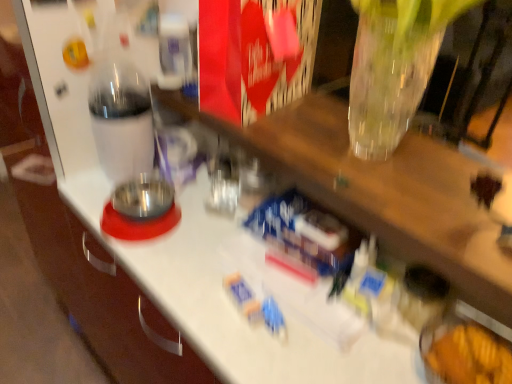
Question: From a real-world perspective, relative to transparent plastic bottle at left, is blue plastic toy at center, the second toy when ordered from top to bottom, vertically above or below?

Choices:
 (A) below
 (B) above

Answer: (A)

Question: Would you say blue plastic toy at center, the second toy when ordered from top to bottom, is to the left or to the right of transparent plastic bottle at left in the picture?

Choices:
 (A) left
 (B) right

Answer: (B)

Question: Which is farther from the transparent plastic bottle at left?

Choices:
 (A) blue plastic toy at center, the 1th toy when ordered from bottom to top
 (B) blue plastic toy at center, placed as the first toy when sorted from top to bottom

Answer: (A)

Question: Based on their relative distances, which object is farther from the blue plastic toy at center, the 1th toy when ordered from bottom to top?

Choices:
 (A) blue plastic toy at center, arranged as the 2th toy when ordered from the bottom
 (B) transparent plastic bottle at left

Answer: (B)